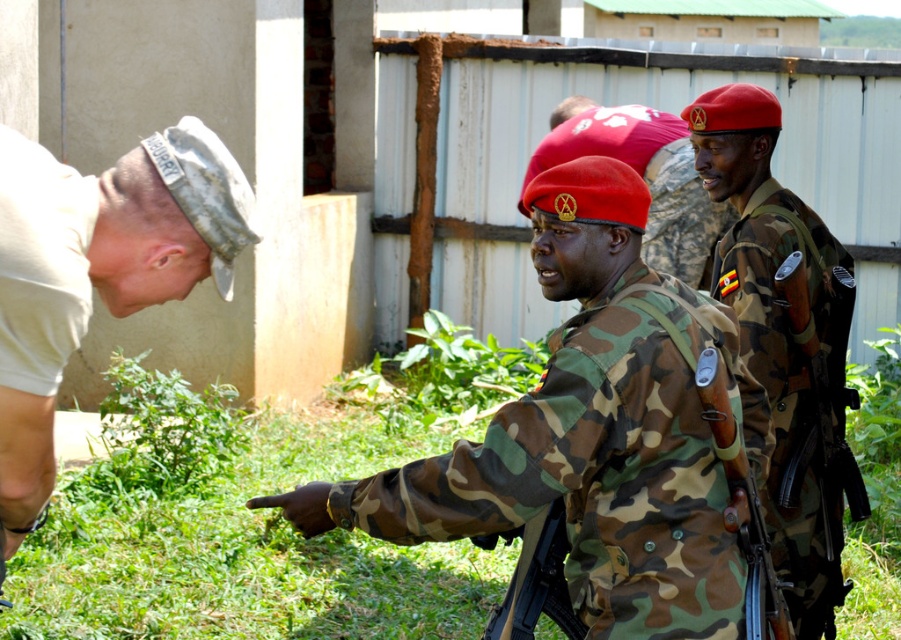
Who is positioned more to the right, camouflage fabric uniform at center or camo fabric uniform at right?

From the viewer's perspective, camo fabric uniform at right appears more on the right side.

Between point (583, 336) and point (772, 326), which one is positioned in front?

Point (583, 336)

The height and width of the screenshot is (640, 901). I want to click on camouflage fabric uniform at center, so click(602, 467).

This screenshot has height=640, width=901. Find the location of `camouflage fabric uniform at center`. camouflage fabric uniform at center is located at coordinates (602, 467).

Which is above, camo fabric uniform at right or white cotton t-shirt at left?

white cotton t-shirt at left

Does camo fabric uniform at right appear on the left side of white cotton t-shirt at left?

No, camo fabric uniform at right is not to the left of white cotton t-shirt at left.

Locate an element on the screen. This screenshot has width=901, height=640. camo fabric uniform at right is located at coordinates (797, 388).

Based on the photo, which of these two, white matte cap at lower left or white cotton t-shirt at left, stands shorter?

With less height is white cotton t-shirt at left.

How distant is white matte cap at lower left from white cotton t-shirt at left?

A distance of 2.30 inches exists between white matte cap at lower left and white cotton t-shirt at left.

Is point (190, 262) in front of point (49, 316)?

No, it is not.

I want to click on white matte cap at lower left, so click(96, 273).